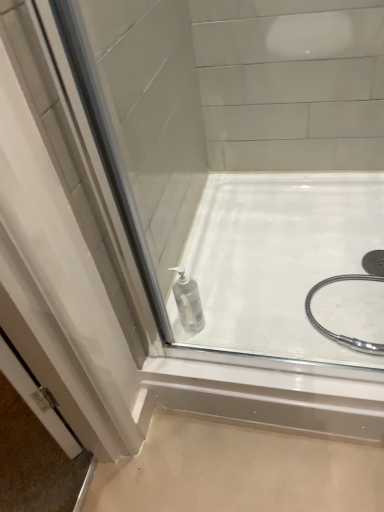
Question: Looking at the image, does transparent plastic bottle at lower center seem bigger or smaller compared to transparent plastic bottle at center?

Choices:
 (A) big
 (B) small

Answer: (B)

Question: Considering the relative positions of transparent plastic bottle at lower center and transparent plastic bottle at center in the image provided, is transparent plastic bottle at lower center to the left or to the right of transparent plastic bottle at center?

Choices:
 (A) right
 (B) left

Answer: (B)

Question: Considering the positions of transparent plastic bottle at lower center and transparent plastic bottle at center in the image, is transparent plastic bottle at lower center wider or thinner than transparent plastic bottle at center?

Choices:
 (A) wide
 (B) thin

Answer: (B)

Question: From the image's perspective, is transparent plastic bottle at center positioned above or below transparent plastic bottle at lower center?

Choices:
 (A) above
 (B) below

Answer: (A)

Question: From a real-world perspective, relative to transparent plastic bottle at lower center, is transparent plastic bottle at center vertically above or below?

Choices:
 (A) below
 (B) above

Answer: (A)

Question: Is transparent plastic bottle at center inside the boundaries of transparent plastic bottle at lower center, or outside?

Choices:
 (A) outside
 (B) inside

Answer: (A)

Question: Does point (339, 237) appear closer or farther from the camera than point (190, 287)?

Choices:
 (A) farther
 (B) closer

Answer: (A)